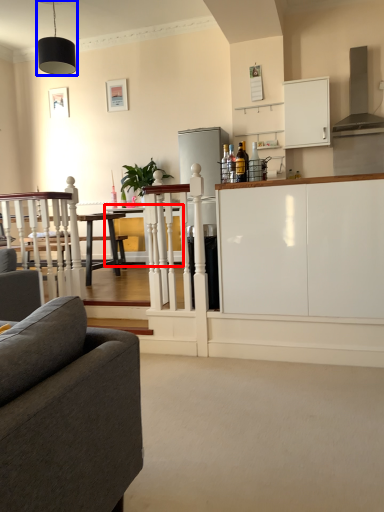
Question: Which point is closer to the camera, table (highlighted by a red box) or light fixture (highlighted by a blue box)?

Choices:
 (A) table
 (B) light fixture

Answer: (B)